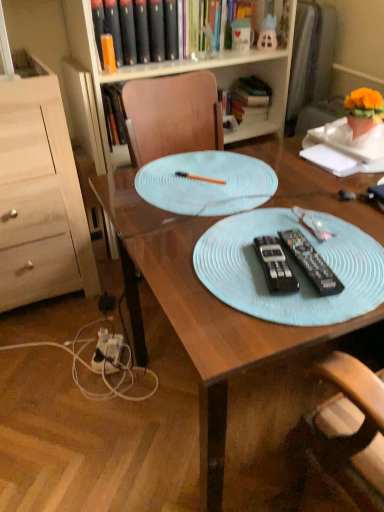
Find the location of a particular element. The height and width of the screenshot is (512, 384). free space to the right of orange plastic pen at center is located at coordinates (282, 180).